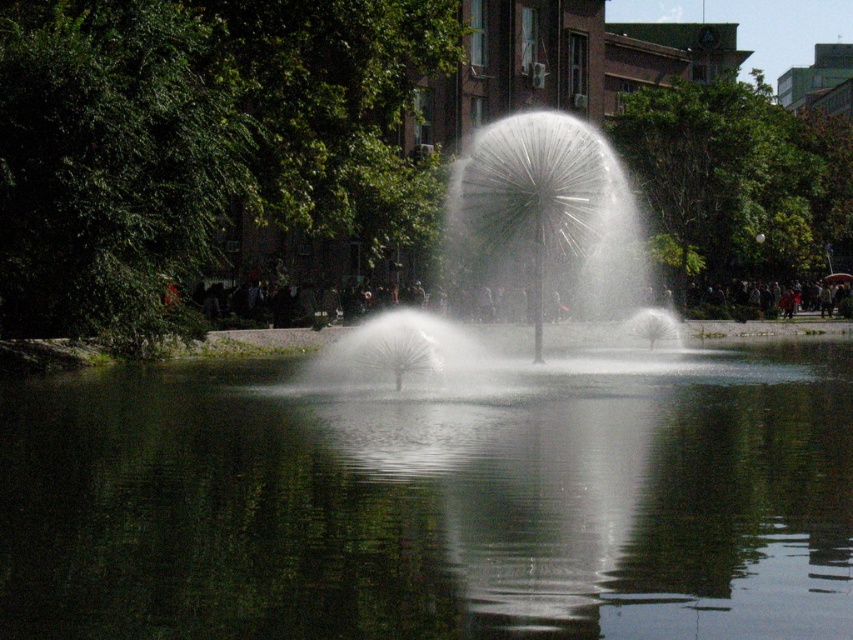
Is transparent liquid water at center positioned at the back of white frothy water at center?

No, it is not.

Is transparent liquid water at center thinner than white frothy water at center?

Incorrect, transparent liquid water at center's width is not less than white frothy water at center's.

Where is `transparent liquid water at center`? This screenshot has width=853, height=640. transparent liquid water at center is located at coordinates (431, 504).